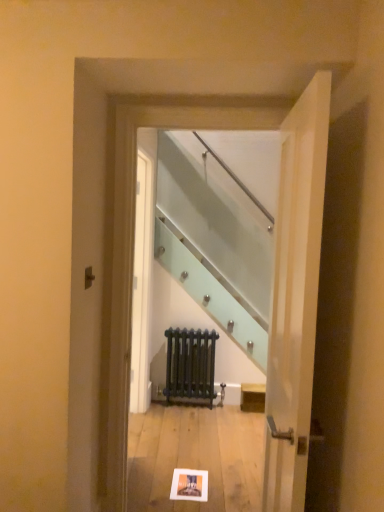
Question: From the image's perspective, is clear glass staircase at center below matte black radiator at center?

Choices:
 (A) no
 (B) yes

Answer: (A)

Question: Can you confirm if clear glass staircase at center is thinner than matte black radiator at center?

Choices:
 (A) no
 (B) yes

Answer: (A)

Question: Is clear glass staircase at center completely or partially outside of matte black radiator at center?

Choices:
 (A) no
 (B) yes

Answer: (B)

Question: From a real-world perspective, is clear glass staircase at center positioned over matte black radiator at center based on gravity?

Choices:
 (A) yes
 (B) no

Answer: (A)

Question: Is clear glass staircase at center taller than matte black radiator at center?

Choices:
 (A) yes
 (B) no

Answer: (A)

Question: Is the depth of clear glass staircase at center greater than that of matte black radiator at center?

Choices:
 (A) no
 (B) yes

Answer: (A)

Question: Can you confirm if white paper postcard at center is taller than clear glass staircase at center?

Choices:
 (A) no
 (B) yes

Answer: (A)

Question: Is white paper postcard at center oriented towards clear glass staircase at center?

Choices:
 (A) yes
 (B) no

Answer: (B)

Question: From a real-world perspective, does white paper postcard at center sit lower than clear glass staircase at center?

Choices:
 (A) no
 (B) yes

Answer: (B)

Question: Does white paper postcard at center have a lesser width compared to clear glass staircase at center?

Choices:
 (A) no
 (B) yes

Answer: (A)

Question: Is white paper postcard at center bigger than clear glass staircase at center?

Choices:
 (A) yes
 (B) no

Answer: (B)

Question: From the image's perspective, is white paper postcard at center under clear glass staircase at center?

Choices:
 (A) no
 (B) yes

Answer: (B)

Question: Considering the relative positions of clear glass staircase at center and white wood door at right in the image provided, is clear glass staircase at center to the right of white wood door at right from the viewer's perspective?

Choices:
 (A) yes
 (B) no

Answer: (B)